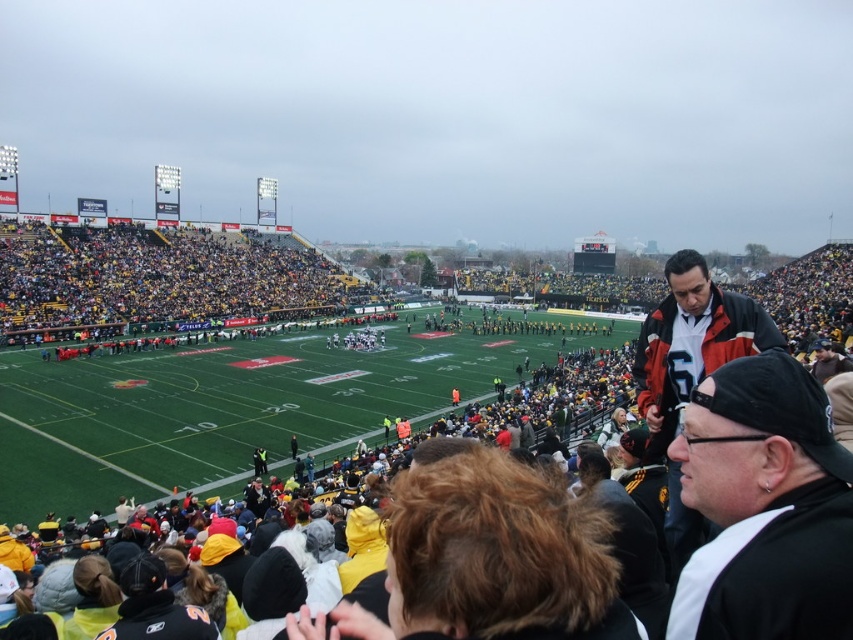
Question: Which point is closer to the camera?

Choices:
 (A) (807, 515)
 (B) (666, 426)

Answer: (A)

Question: Considering the relative positions of black matte cap at upper right and matte black jacket at center in the image provided, where is black matte cap at upper right located with respect to matte black jacket at center?

Choices:
 (A) above
 (B) below

Answer: (B)

Question: Is black matte cap at upper right below matte black jacket at center?

Choices:
 (A) yes
 (B) no

Answer: (A)

Question: Can you confirm if black matte cap at upper right is positioned above matte black jacket at center?

Choices:
 (A) no
 (B) yes

Answer: (A)